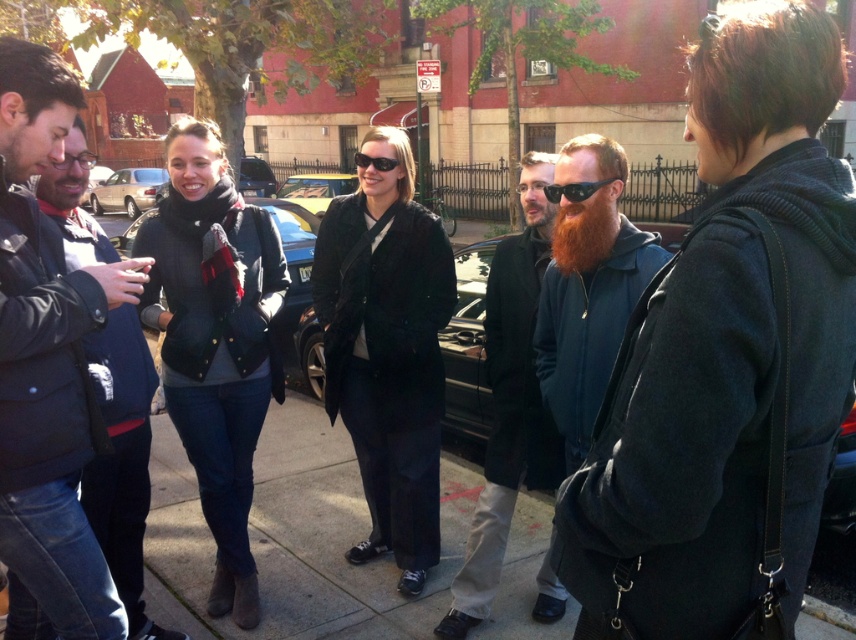
You are a delivery person who needs to place a package between the matte black coat at center and the shiny black car at center. The package requires a space of 15 meters. Is there enough space?

The distance between the matte black coat at center and the shiny black car at center is 15.57 meters, which is more than enough to accommodate the 15 meter requirement for the package.

You are a photographer standing at the origin point of the image coordinate system. You want to take a photo of the matte black coat at center. What are the coordinates where you should aim your camera?

The coordinates to aim your camera are at point (387, 349), which is where the matte black coat at center is located.